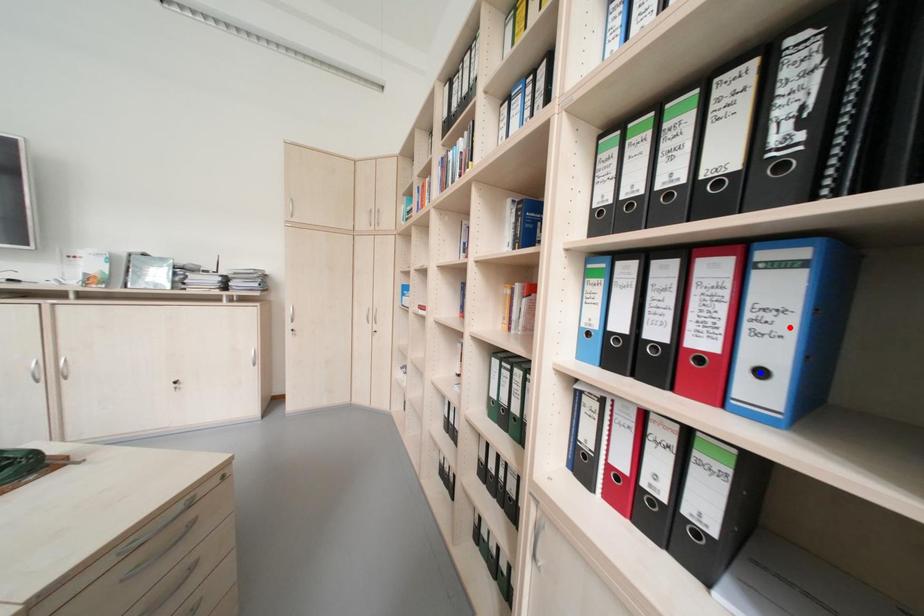
Question: Two points are marked on the image. Which point is closer to the camera?

Choices:
 (A) Blue point is closer.
 (B) Red point is closer.

Answer: (B)